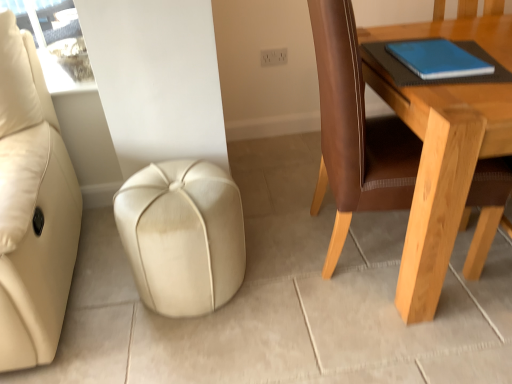
Question: In the image, is beige leather ottoman at center on the left side or the right side of light brown wooden table at right?

Choices:
 (A) left
 (B) right

Answer: (A)

Question: Considering their positions, is beige leather ottoman at center located in front of or behind light brown wooden table at right?

Choices:
 (A) front
 (B) behind

Answer: (B)

Question: Estimate the real-world distances between objects in this image. Which object is farther from the blue matte notebook at upper right?

Choices:
 (A) beige leather ottoman at center
 (B) light brown wooden table at right

Answer: (A)

Question: Estimate the real-world distances between objects in this image. Which object is closer to the light brown wooden table at right?

Choices:
 (A) beige leather ottoman at center
 (B) blue matte notebook at upper right

Answer: (B)